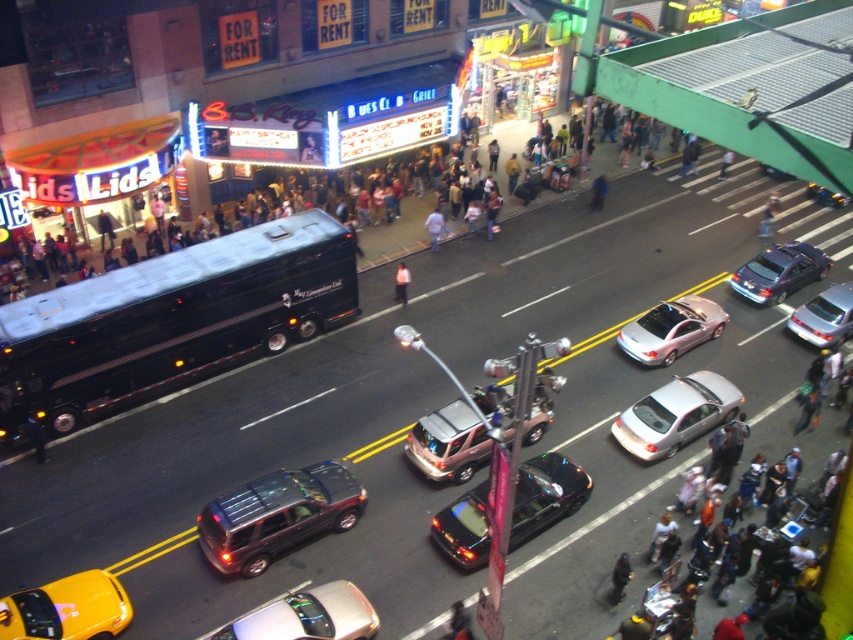
Is metallic dark suv at center positioned before shiny black sedan at center?

Yes.

Is point (236, 524) positioned after point (535, 461)?

No, (236, 524) is closer to viewer.

The image size is (853, 640). Find the location of `metallic dark suv at center`. metallic dark suv at center is located at coordinates (277, 515).

Does silver metallic sedan at center-right have a smaller size compared to light blue jeans at crosswalk?

Yes.

Who is positioned more to the right, silver metallic sedan at center-right or light blue jeans at crosswalk?

light blue jeans at crosswalk

Between point (631, 452) and point (727, 148), which one is positioned in front?

Point (631, 452) is in front.

Identify the location of silver metallic sedan at center-right. (675, 413).

Does metallic dark suv at center come in front of satin silver sedan at center-right?

Yes.

Does metallic dark suv at center have a smaller size compared to satin silver sedan at center-right?

No, metallic dark suv at center is not smaller than satin silver sedan at center-right.

Is point (294, 472) closer to camera compared to point (799, 282)?

That is True.

Locate an element on the screen. Image resolution: width=853 pixels, height=640 pixels. metallic dark suv at center is located at coordinates (277, 515).